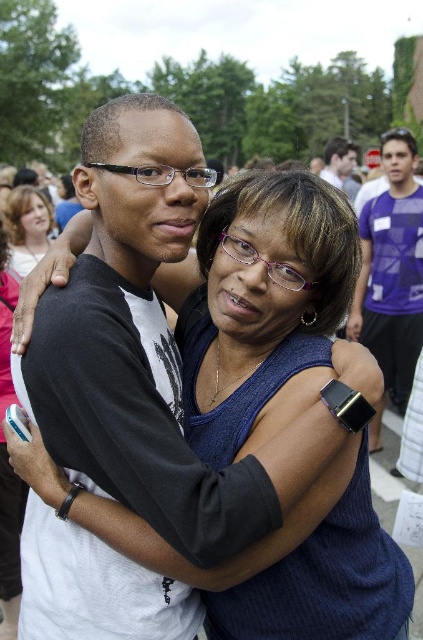
You are standing in the crowd at this event and want to take a photo of both the point at coordinates point (387, 145) and point (24, 266). Which point should you focus on first to ensure both are in focus?

You should focus on point (387, 145) first because it is closer to you than point (24, 266), ensuring both are within the depth of field.

You are a photographer trying to capture this touching moment. You notice the matte black hair at upper left and the matte black watch at upper right in your frame. Which object should you adjust your focus to ensure the taller one is in sharp focus?

The matte black watch at upper right is taller than the matte black hair at upper left, so you should focus on the matte black watch at upper right to ensure the taller object is in sharp focus.